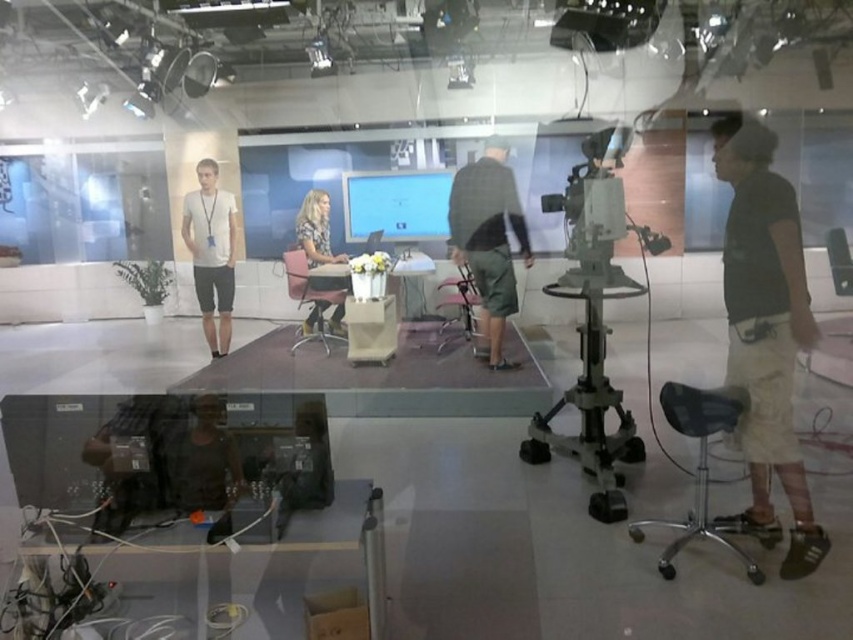
You are a stagehand setting up the studio. You need to place a new microphone stand between the black cotton shirt at right and the pink fabric chair at center. Based on their positions, where should you place the microphone stand relative to these two objects?

The black cotton shirt at right is below the pink fabric chair at center, so the microphone stand should be placed between them, positioning it above the black cotton shirt at right and below the pink fabric chair at center to maintain spatial alignment.

You are a stagehand in the studio and need to place a new microphone stand between the black cotton shirt at right and the pink fabric chair at center. Which object should you position the stand closer to if the stand is 1 meter wide?

The black cotton shirt at right is smaller than the pink fabric chair at center, so the microphone stand should be placed closer to the black cotton shirt at right to ensure enough space between them.